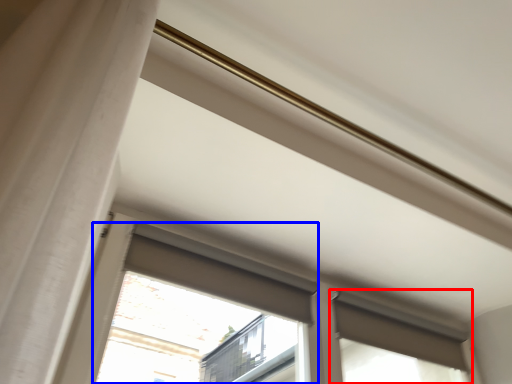
Question: Which object appears closest to the camera in this image, window (highlighted by a red box) or bay window (highlighted by a blue box)?

Choices:
 (A) window
 (B) bay window

Answer: (B)